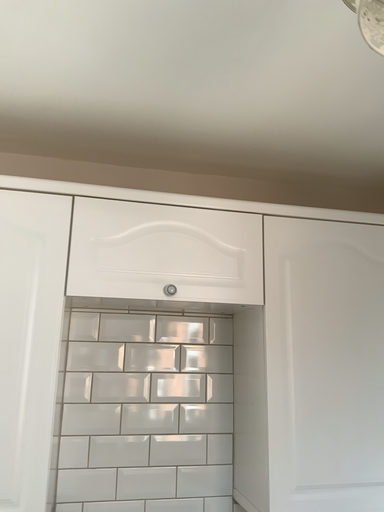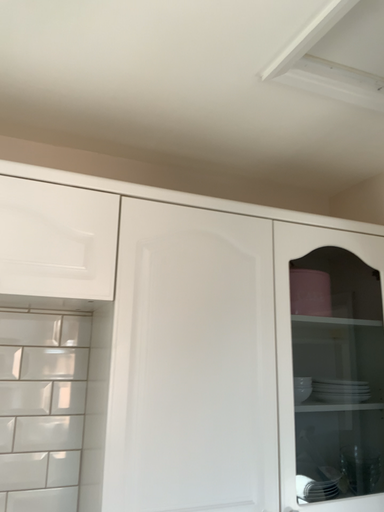
Question: How did the camera likely rotate when shooting the video?

Choices:
 (A) rotated left
 (B) rotated right

Answer: (B)